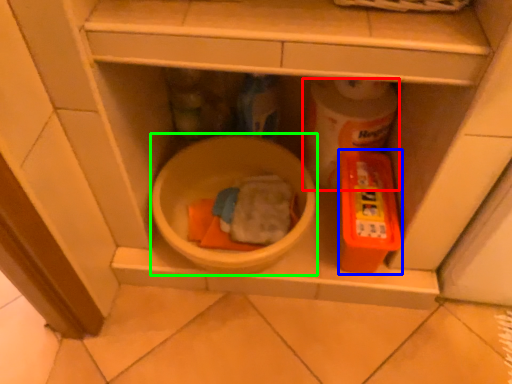
Question: Considering the real-world distances, which object is closest to toilet paper (highlighted by a red box)? toy (highlighted by a blue box) or mixing bowl (highlighted by a green box).

Choices:
 (A) toy
 (B) mixing bowl

Answer: (A)